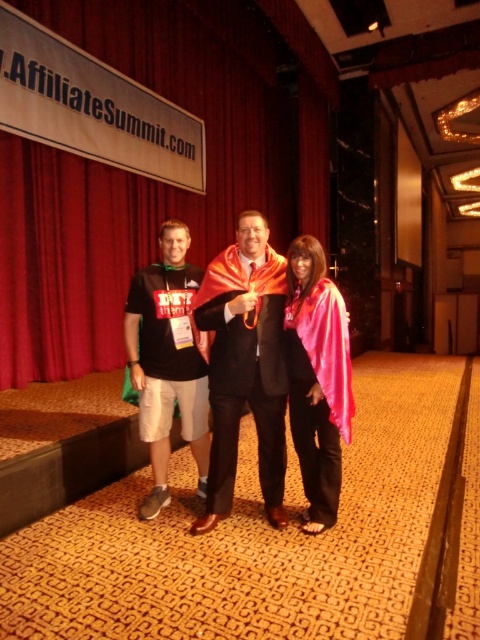
Who is taller, matte black t-shirt at center or pink satin cape at center?

matte black t-shirt at center is taller.

Measure the distance between matte black t-shirt at center and pink satin cape at center.

matte black t-shirt at center and pink satin cape at center are 24.53 inches apart from each other.

Who is more forward, (192, 422) or (298, 330)?

Point (298, 330)

Where is `matte black t-shirt at center`? This screenshot has height=640, width=480. matte black t-shirt at center is located at coordinates (167, 360).

Is shiny orange cape at center taller than pink satin cape at center?

Indeed, shiny orange cape at center has a greater height compared to pink satin cape at center.

Is shiny orange cape at center below pink satin cape at center?

No, shiny orange cape at center is not below pink satin cape at center.

Measure the distance between shiny orange cape at center and camera.

A distance of 8.08 feet exists between shiny orange cape at center and camera.

Image resolution: width=480 pixels, height=640 pixels. Identify the location of shiny orange cape at center. (244, 364).

Based on the photo, is red velvet curtain at upper center to the right of shiny orange cape at center from the viewer's perspective?

Correct, you'll find red velvet curtain at upper center to the right of shiny orange cape at center.

Can you confirm if red velvet curtain at upper center is wider than shiny orange cape at center?

No, red velvet curtain at upper center is not wider than shiny orange cape at center.

Find the location of `red velvet curtain at upper center`. red velvet curtain at upper center is located at coordinates (154, 179).

Where is `red velvet curtain at upper center`? The width and height of the screenshot is (480, 640). red velvet curtain at upper center is located at coordinates tap(154, 179).